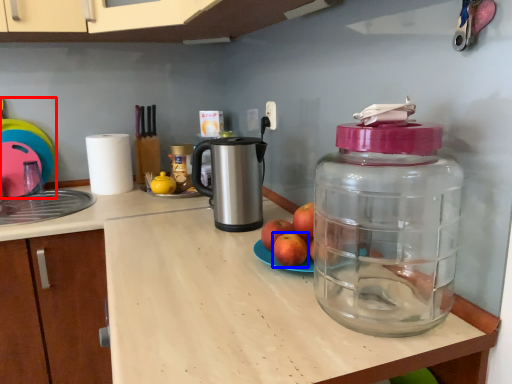
Question: Which of the following is the closest to the observer, toy (highlighted by a red box) or apple (highlighted by a blue box)?

Choices:
 (A) toy
 (B) apple

Answer: (B)